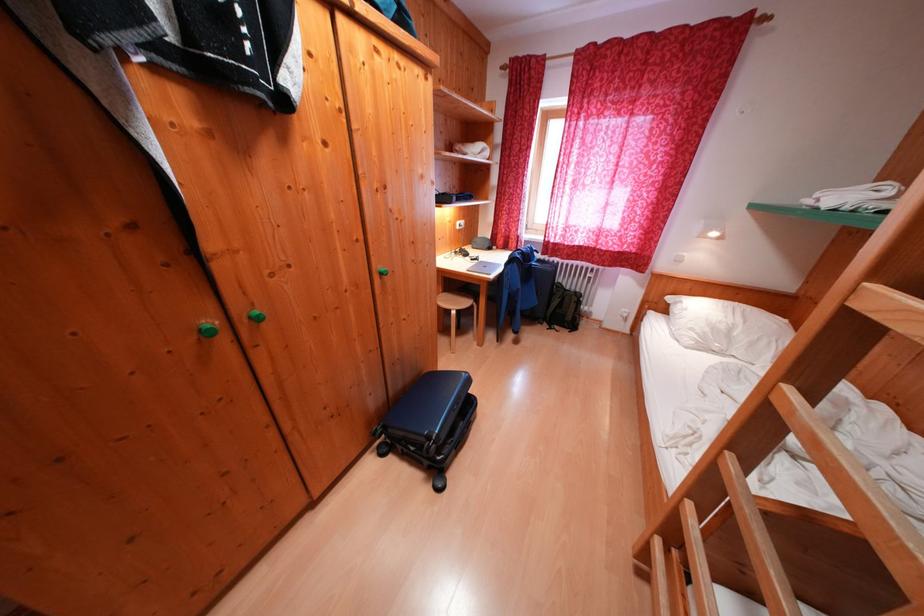
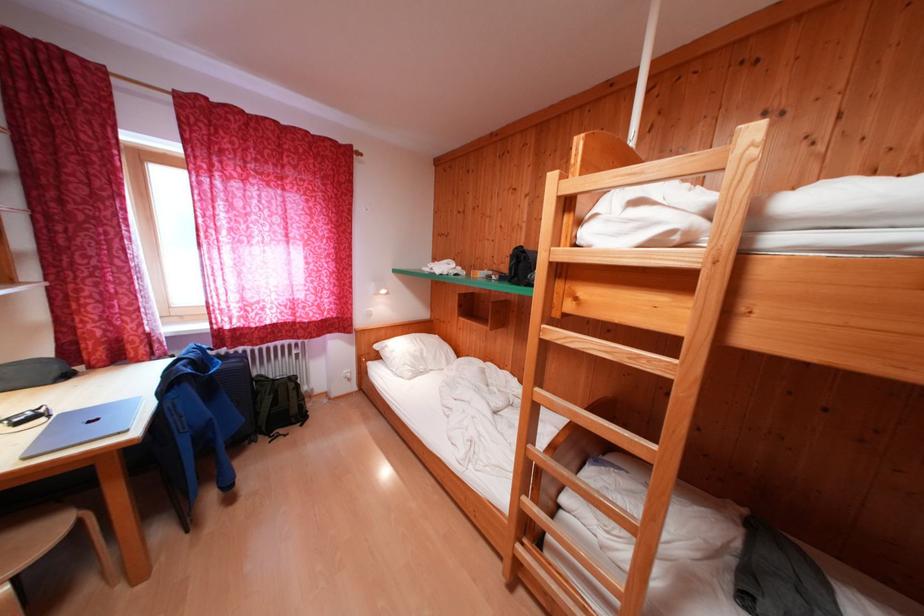
Where in the second image is the point corresponding to point 473,307 from the first image?

(55, 538)